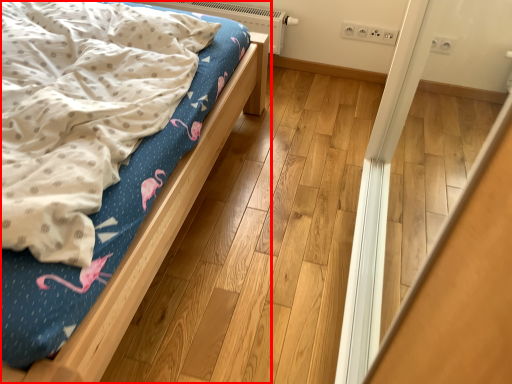
Question: From the image's perspective, what is the correct spatial relationship of bed (annotated by the red box) in relation to heater?

Choices:
 (A) above
 (B) below

Answer: (B)